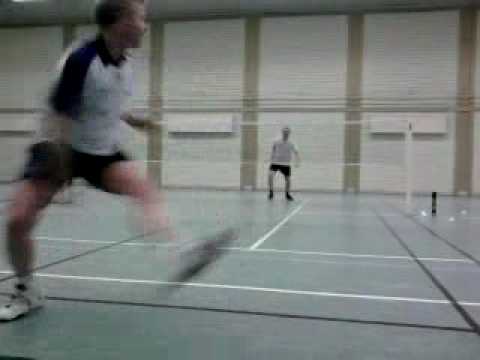
I want to click on wall in background, so click(279, 68).